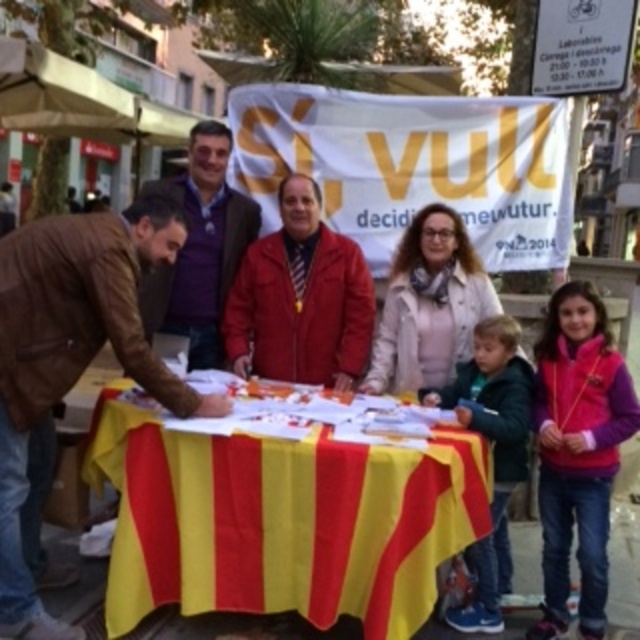
Question: Is yellow/red striped fabric at center in front of brown leather jacket at left?

Choices:
 (A) yes
 (B) no

Answer: (B)

Question: Which object is closer to the camera taking this photo?

Choices:
 (A) brown leather jacket at left
 (B) yellow/red striped fabric at center
 (C) pink fleece vest at lower right

Answer: (A)

Question: Which object appears farthest from the camera in this image?

Choices:
 (A) yellow/red striped fabric at center
 (B) dark green jacket at lower center
 (C) purple soft shirt at center
 (D) brown leather jacket at left

Answer: (C)

Question: Does purple soft shirt at center appear over dark green jacket at lower center?

Choices:
 (A) no
 (B) yes

Answer: (B)

Question: Is yellow/red striped fabric at center to the right of pink fleece vest at lower right from the viewer's perspective?

Choices:
 (A) no
 (B) yes

Answer: (A)

Question: Which of these objects is positioned farthest from the pink fleece vest at lower right?

Choices:
 (A) purple soft shirt at center
 (B) brown leather jacket at left

Answer: (A)